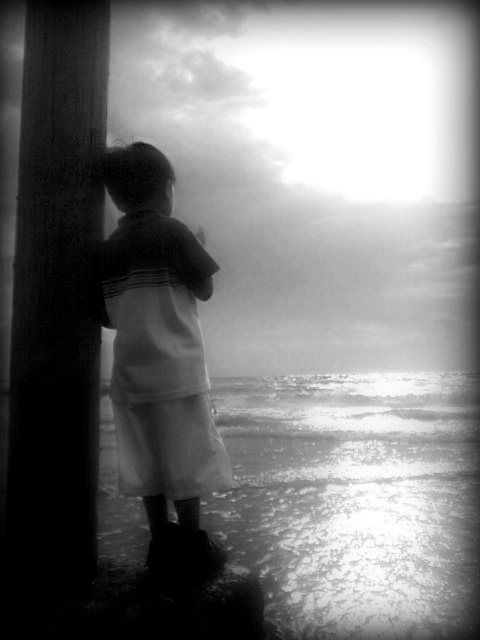
Question: Which of the following is the closest to the observer?

Choices:
 (A) (166, 284)
 (B) (253, 448)
 (C) (74, 413)

Answer: (C)

Question: Which point appears farthest from the camera in this image?

Choices:
 (A) (168, 202)
 (B) (37, 364)

Answer: (A)

Question: Is reflective wet sand at lower center above white cotton shirt at left?

Choices:
 (A) yes
 (B) no

Answer: (B)

Question: Which point is farther from the camera taking this photo?

Choices:
 (A) (60, 268)
 (B) (158, 403)

Answer: (B)

Question: Does reflective wet sand at lower center appear on the left side of smooth wood post at left?

Choices:
 (A) yes
 (B) no

Answer: (B)

Question: Can you confirm if reflective wet sand at lower center is positioned to the right of smooth wood post at left?

Choices:
 (A) yes
 (B) no

Answer: (A)